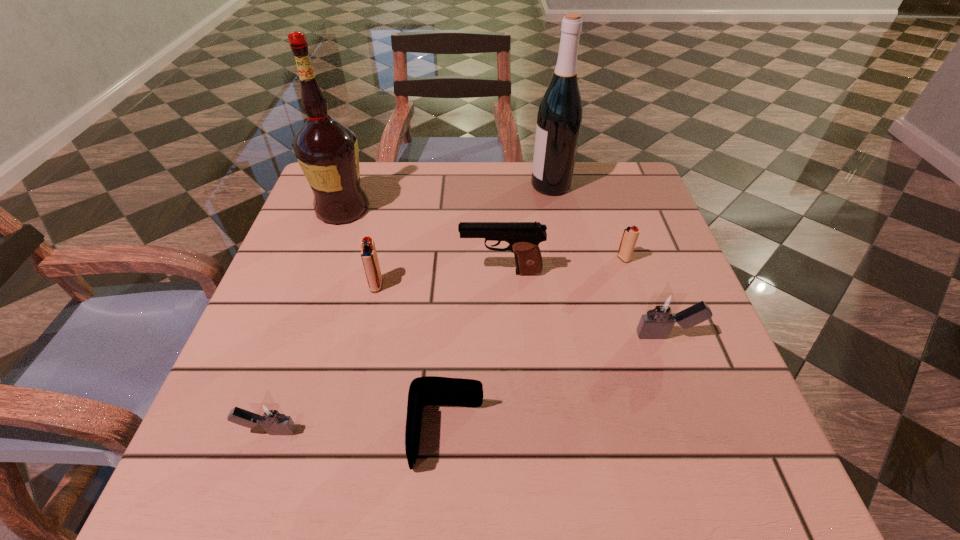
Where is `wine bottle`? Image resolution: width=960 pixels, height=540 pixels. wine bottle is located at coordinates (559, 118).

Locate an element on the screen. dark wine bottle is located at coordinates (559, 118).

Find the location of a particular element. This screenshot has height=540, width=960. alcohol is located at coordinates (327, 151).

In order to click on pistol in this screenshot , I will do `click(523, 237)`.

You are a GUI agent. You are given a task and a screenshot of the screen. Output one action in this format:
    pyautogui.click(x=<x>, y=<y>)
    Task: Click on the black pistol
    
    Given the screenshot: What is the action you would take?
    (x=523, y=237)

The height and width of the screenshot is (540, 960). Find the location of `the third farthest igniter`. the third farthest igniter is located at coordinates (x=662, y=312).

Locate an element on the screen. the right gray igniter is located at coordinates (662, 312).

Identify the location of the third nearest igniter. pyautogui.click(x=369, y=257).

Locate an element on the screen. Image resolution: width=960 pixels, height=540 pixels. the nearer red igniter is located at coordinates (369, 257).

Locate an element on the screen. the third farthest object is located at coordinates (630, 235).